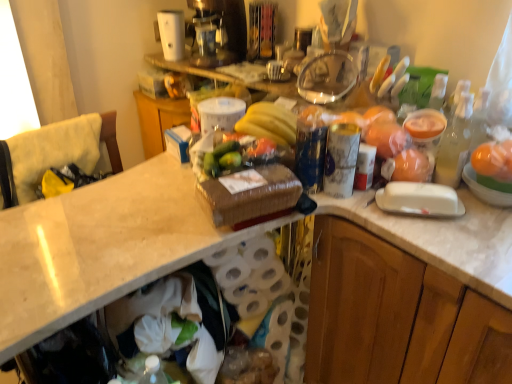
Identify the location of vacant space situated above yellow fabric cushion at left (from a real-world perspective). The image size is (512, 384). (45, 129).